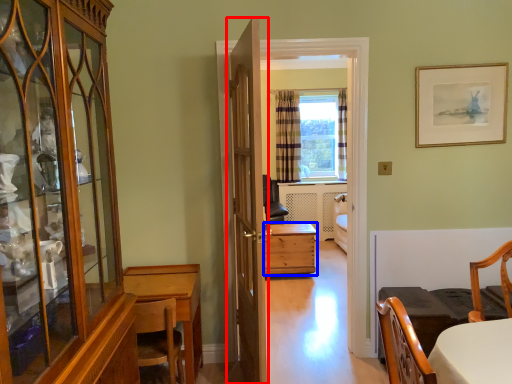
Question: Which object appears farthest to the camera in this image, door (highlighted by a red box) or desk (highlighted by a blue box)?

Choices:
 (A) door
 (B) desk

Answer: (B)